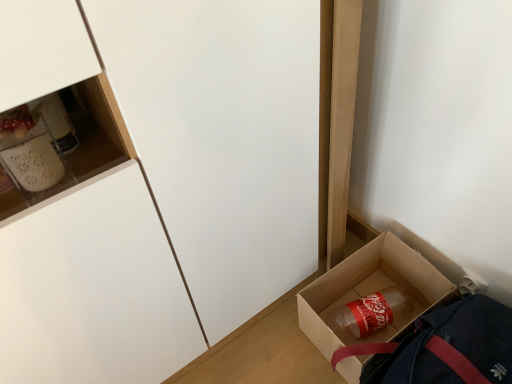
The image size is (512, 384). I want to click on brown cardboard box at lower right, so click(371, 291).

Consider the image. How different are the orientations of translucent plastic bottle at lower right and brown cardboard box at lower right in degrees?

19.2 degrees separate the facing orientations of translucent plastic bottle at lower right and brown cardboard box at lower right.

Is point (396, 321) farther from camera compared to point (385, 242)?

No.

Between translucent plastic bottle at lower right and brown cardboard box at lower right, which one has less height?

With less height is translucent plastic bottle at lower right.

Could you measure the distance between translucent plastic bottle at lower right and brown cardboard box at lower right?

They are 2.68 inches apart.

From a real-world perspective, who is located higher, translucent plastic bottle at lower right or matte white cabinet at lower left?

matte white cabinet at lower left.

From the image's perspective, is translucent plastic bottle at lower right on matte white cabinet at lower left?

No, from the image's perspective, translucent plastic bottle at lower right is not on top of matte white cabinet at lower left.

Is matte white cabinet at lower left a part of translucent plastic bottle at lower right?

No.

This screenshot has width=512, height=384. There is a translucent plastic bottle at lower right. In order to click on cabinetry above it (from a real-world perspective) in this screenshot , I will do `click(168, 183)`.

Is brown cardboard box at lower right bigger than translucent plastic bottle at lower right?

Indeed, brown cardboard box at lower right has a larger size compared to translucent plastic bottle at lower right.

What's the angular difference between brown cardboard box at lower right and translucent plastic bottle at lower right's facing directions?

brown cardboard box at lower right and translucent plastic bottle at lower right are facing 19.2 degrees away from each other.

How far apart are brown cardboard box at lower right and translucent plastic bottle at lower right?

2.68 inches.

Is the depth of brown cardboard box at lower right greater than that of translucent plastic bottle at lower right?

No, it is not.

Between matte white cabinet at lower left and translucent plastic bottle at lower right, which one has smaller size?

translucent plastic bottle at lower right is smaller.

Is matte white cabinet at lower left inside the boundaries of translucent plastic bottle at lower right, or outside?

matte white cabinet at lower left is spatially situated outside translucent plastic bottle at lower right.

Is matte white cabinet at lower left facing towards translucent plastic bottle at lower right?

Yes, matte white cabinet at lower left faces towards translucent plastic bottle at lower right.

Does matte white cabinet at lower left have a lesser height compared to translucent plastic bottle at lower right?

No.

From a real-world perspective, is matte white cabinet at lower left above or below brown cardboard box at lower right?

In terms of real-world spatial position, matte white cabinet at lower left is above brown cardboard box at lower right.

From the image's perspective, does matte white cabinet at lower left appear lower than brown cardboard box at lower right?

No, from the image's perspective, matte white cabinet at lower left is not below brown cardboard box at lower right.

Are matte white cabinet at lower left and brown cardboard box at lower right far apart?

No, there isn't a large distance between matte white cabinet at lower left and brown cardboard box at lower right.

In terms of width, does matte white cabinet at lower left look wider or thinner when compared to brown cardboard box at lower right?

In the image, matte white cabinet at lower left appears to be wider than brown cardboard box at lower right.

Is brown cardboard box at lower right next to matte white cabinet at lower left and touching it?

No, brown cardboard box at lower right is not with matte white cabinet at lower left.

From a real-world perspective, is brown cardboard box at lower right positioned above or below matte white cabinet at lower left?

brown cardboard box at lower right is below matte white cabinet at lower left.

Does point (383, 244) appear closer or farther from the camera than point (115, 163)?

Point (383, 244) is positioned farther from the camera compared to point (115, 163).

Identify the location of beverage that appears below the brown cardboard box at lower right (from a real-world perspective). (371, 313).

Locate an element on the screen. beverage that appears behind the matte white cabinet at lower left is located at coordinates (371, 313).

Based on their spatial positions, is translucent plastic bottle at lower right or brown cardboard box at lower right further from matte white cabinet at lower left?

translucent plastic bottle at lower right is positioned further to the anchor matte white cabinet at lower left.

Which object lies nearer to the anchor point translucent plastic bottle at lower right, matte white cabinet at lower left or brown cardboard box at lower right?

brown cardboard box at lower right is positioned closer to the anchor translucent plastic bottle at lower right.

Estimate the real-world distances between objects in this image. Which object is closer to brown cardboard box at lower right, matte white cabinet at lower left or translucent plastic bottle at lower right?

Among the two, translucent plastic bottle at lower right is located nearer to brown cardboard box at lower right.

From the picture: From the image, which object appears to be farther from translucent plastic bottle at lower right, brown cardboard box at lower right or matte white cabinet at lower left?

Based on the image, matte white cabinet at lower left appears to be further to translucent plastic bottle at lower right.

Which object lies further to the anchor point matte white cabinet at lower left, brown cardboard box at lower right or translucent plastic bottle at lower right?

translucent plastic bottle at lower right is further to matte white cabinet at lower left.

Based on the photo, based on their spatial positions, is translucent plastic bottle at lower right or matte white cabinet at lower left closer to brown cardboard box at lower right?

Based on the image, translucent plastic bottle at lower right appears to be nearer to brown cardboard box at lower right.

Where is `box between matte white cabinet at lower left and translucent plastic bottle at lower right from front to back`? The image size is (512, 384). box between matte white cabinet at lower left and translucent plastic bottle at lower right from front to back is located at coordinates (371, 291).